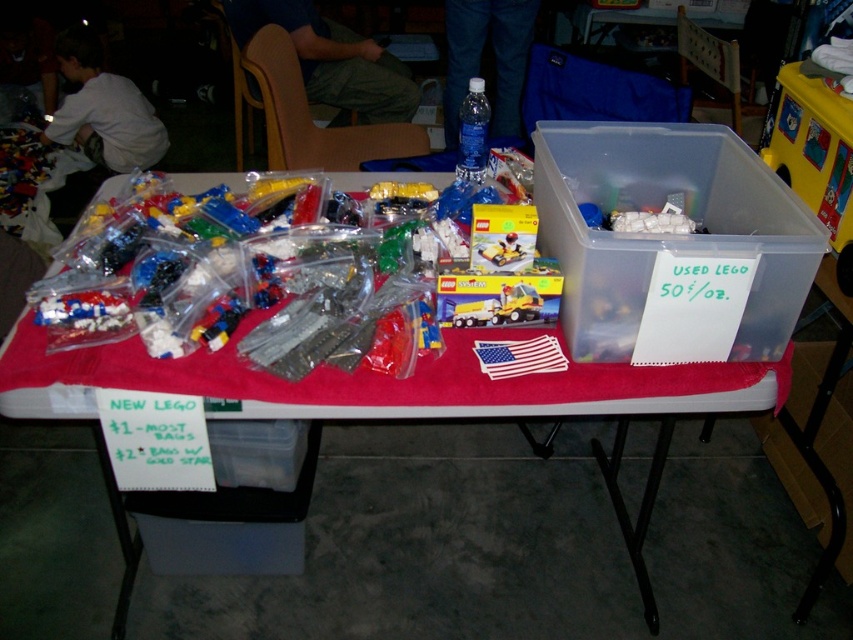
Does white matte shirt at upper left have a lesser width compared to transparent plastic bottle at upper center?

Incorrect, white matte shirt at upper left's width is not less than transparent plastic bottle at upper center's.

Who is higher up, white matte shirt at upper left or transparent plastic bottle at upper center?

white matte shirt at upper left

Between point (106, 140) and point (477, 148), which one is positioned behind?

The point (106, 140) is more distant.

The image size is (853, 640). I want to click on white matte shirt at upper left, so click(103, 109).

Between red fabric table at center and white matte shirt at upper left, which one appears on the left side from the viewer's perspective?

Positioned to the left is white matte shirt at upper left.

What do you see at coordinates (511, 406) in the screenshot? This screenshot has width=853, height=640. I see `red fabric table at center` at bounding box center [511, 406].

Find the location of a particular element. This screenshot has height=640, width=853. red fabric table at center is located at coordinates (511, 406).

Is red fabric table at center positioned before transparent plastic bottle at upper center?

Yes, red fabric table at center is closer to the viewer.

Can you confirm if red fabric table at center is bigger than transparent plastic bottle at upper center?

Indeed, red fabric table at center has a larger size compared to transparent plastic bottle at upper center.

Where is `red fabric table at center`? This screenshot has width=853, height=640. red fabric table at center is located at coordinates 511,406.